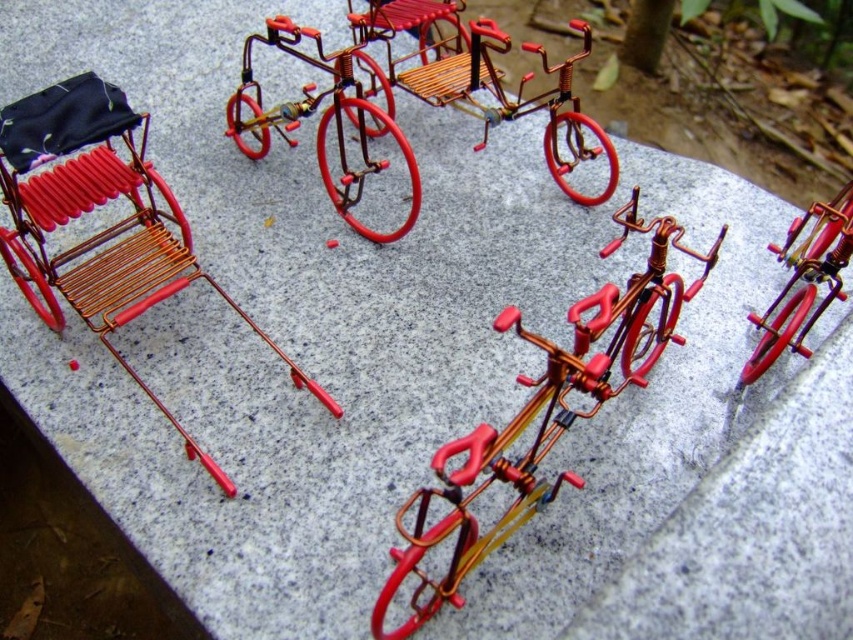
Who is more distant from viewer, (158, 228) or (525, 509)?

The point (158, 228) is behind.

Is matte copper chair at left to the left of copper wire bicycle at center from the viewer's perspective?

Correct, you'll find matte copper chair at left to the left of copper wire bicycle at center.

Is point (155, 269) behind point (624, 316)?

Yes, point (155, 269) is farther from viewer.

This screenshot has width=853, height=640. Identify the location of matte copper chair at left. (103, 228).

The width and height of the screenshot is (853, 640). What do you see at coordinates (543, 417) in the screenshot?
I see `copper wire bicycle at center` at bounding box center [543, 417].

Does copper wire bicycle at center appear over metallic wire tricycle at center?

Incorrect, copper wire bicycle at center is not positioned above metallic wire tricycle at center.

Image resolution: width=853 pixels, height=640 pixels. What are the coordinates of `copper wire bicycle at center` in the screenshot? It's located at (543, 417).

Between matte copper chair at left and metallic red bicycle at center, which one is positioned lower?

Positioned lower is metallic red bicycle at center.

Between matte copper chair at left and metallic red bicycle at center, which one has less height?

metallic red bicycle at center is shorter.

Is point (65, 184) behind point (795, 298)?

Yes, it is.

I want to click on matte copper chair at left, so click(103, 228).